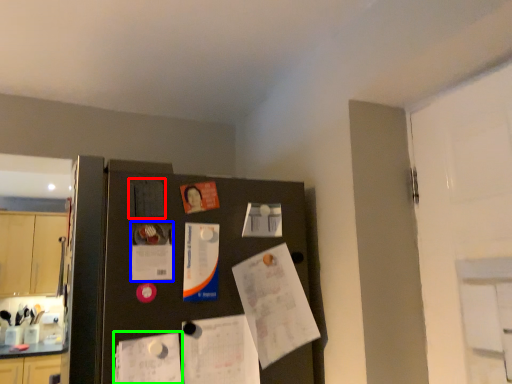
Question: Estimate the real-world distances between objects in this image. Which object is closer to poster (highlighted by a red box), poster (highlighted by a blue box) or poster (highlighted by a green box)?

Choices:
 (A) poster
 (B) poster

Answer: (A)